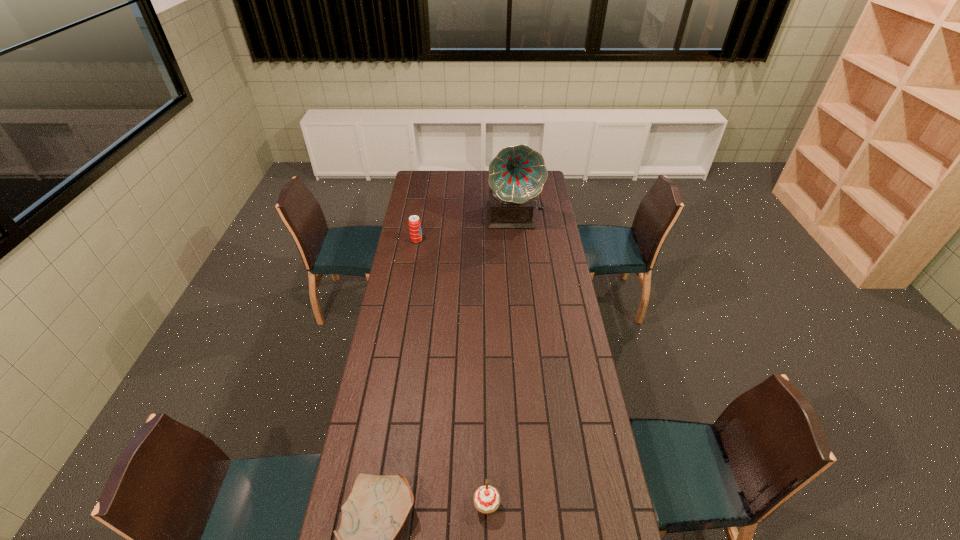
Where is `vacant space at the far edge of the desktop`? This screenshot has width=960, height=540. vacant space at the far edge of the desktop is located at coordinates (444, 190).

Where is `vacant space at the left edge of the desktop`? The width and height of the screenshot is (960, 540). vacant space at the left edge of the desktop is located at coordinates (397, 335).

The width and height of the screenshot is (960, 540). Find the location of `vacant space at the right edge of the desktop`. vacant space at the right edge of the desktop is located at coordinates (540, 232).

Identify the location of vacant space at the far right corner of the desktop. (543, 187).

The height and width of the screenshot is (540, 960). What are the coordinates of `vacant space that's between the farthest object and the cupcake` in the screenshot? It's located at (500, 361).

Where is `free space between the third shortest object and the tallest object`? free space between the third shortest object and the tallest object is located at coordinates (466, 228).

At what (x,y) coordinates should I click in order to perform the action: click on vacant area that lies between the tallest object and the second farthest object. Please return your answer as a coordinate pair (x, y). Looking at the image, I should click on [x=466, y=228].

Locate an element on the screen. Image resolution: width=960 pixels, height=540 pixels. free space between the tallest object and the second shortest object is located at coordinates (500, 361).

Identify the location of vacant area between the farthest object and the cupcake. (500, 361).

Image resolution: width=960 pixels, height=540 pixels. I want to click on free spot between the soda can and the cupcake, so click(451, 373).